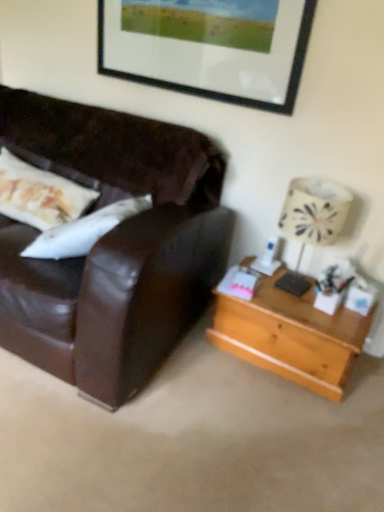
Question: From a real-world perspective, is light brown wooden table at right positioned over black matte picture frame at upper center based on gravity?

Choices:
 (A) no
 (B) yes

Answer: (A)

Question: Is light brown wooden table at right positioned in front of black matte picture frame at upper center?

Choices:
 (A) no
 (B) yes

Answer: (B)

Question: From a real-world perspective, is light brown wooden table at right beneath black matte picture frame at upper center?

Choices:
 (A) no
 (B) yes

Answer: (B)

Question: Could black matte picture frame at upper center be considered to be inside light brown wooden table at right?

Choices:
 (A) no
 (B) yes

Answer: (A)

Question: Are light brown wooden table at right and black matte picture frame at upper center located far from each other?

Choices:
 (A) no
 (B) yes

Answer: (B)

Question: Can you confirm if light brown wooden table at right is shorter than black matte picture frame at upper center?

Choices:
 (A) yes
 (B) no

Answer: (A)

Question: From a real-world perspective, is white fabric lampshade at right located beneath black matte picture frame at upper center?

Choices:
 (A) yes
 (B) no

Answer: (A)

Question: Is white fabric lampshade at right far from black matte picture frame at upper center?

Choices:
 (A) no
 (B) yes

Answer: (A)

Question: From the image's perspective, is white fabric lampshade at right located above black matte picture frame at upper center?

Choices:
 (A) no
 (B) yes

Answer: (A)

Question: Is white fabric lampshade at right positioned behind black matte picture frame at upper center?

Choices:
 (A) yes
 (B) no

Answer: (B)

Question: Is white fabric lampshade at right in front of black matte picture frame at upper center?

Choices:
 (A) no
 (B) yes

Answer: (B)

Question: Can you confirm if white fabric lampshade at right is shorter than black matte picture frame at upper center?

Choices:
 (A) no
 (B) yes

Answer: (A)

Question: Considering the relative sizes of light brown wooden table at right and white fabric lampshade at right in the image provided, is light brown wooden table at right taller than white fabric lampshade at right?

Choices:
 (A) no
 (B) yes

Answer: (A)